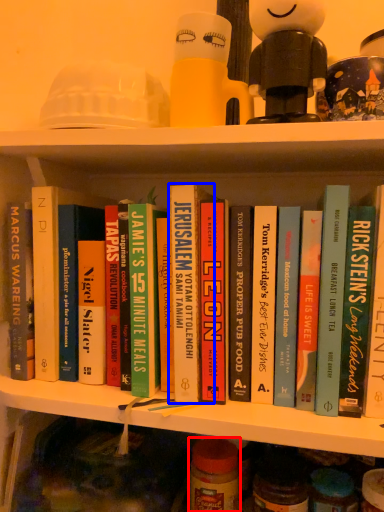
Question: Which object appears closest to the camera in this image, glass jar (highlighted by a red box) or book (highlighted by a blue box)?

Choices:
 (A) glass jar
 (B) book

Answer: (B)